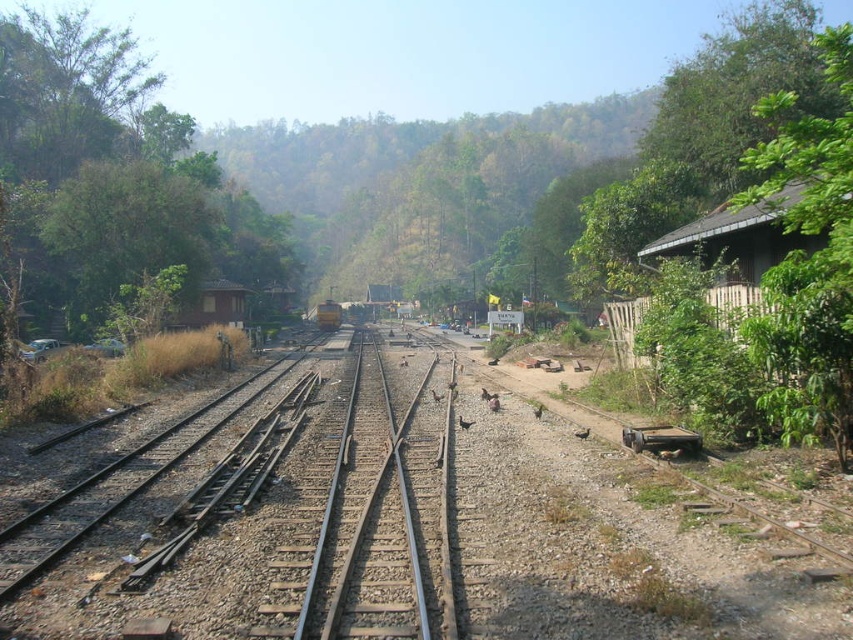
Question: In this image, where is metal/rough track at center located relative to brown feathered bird at center?

Choices:
 (A) left
 (B) right

Answer: (A)

Question: Can you confirm if metal/rough track at center is positioned above brown feathered bird at center?

Choices:
 (A) yes
 (B) no

Answer: (A)

Question: In this image, where is metal/rough track at center located relative to brown feathered bird at center?

Choices:
 (A) right
 (B) left

Answer: (B)

Question: Which point is farther to the camera?

Choices:
 (A) (306, 426)
 (B) (460, 420)

Answer: (B)